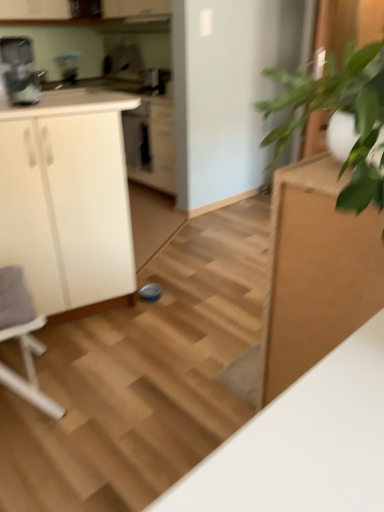
Question: Which is correct: white plastic rocking chair at left is inside green leafy plant at right, or outside of it?

Choices:
 (A) inside
 (B) outside

Answer: (B)

Question: Looking at the image, does white plastic rocking chair at left seem bigger or smaller compared to green leafy plant at right?

Choices:
 (A) big
 (B) small

Answer: (A)

Question: Which of these objects is positioned closest to the white matte cabinet at left?

Choices:
 (A) satin black coffee maker at upper center
 (B) wooden stair at center
 (C) satin black dishwasher at center
 (D) white plastic rocking chair at left
 (E) green leafy plant at right

Answer: (D)

Question: Considering the real-world distances, which object is farthest from the satin black coffee maker at upper center?

Choices:
 (A) white matte cabinet at left
 (B) wooden stair at center
 (C) green leafy plant at right
 (D) white plastic rocking chair at left
 (E) metallic silver coffee machine at upper left

Answer: (C)